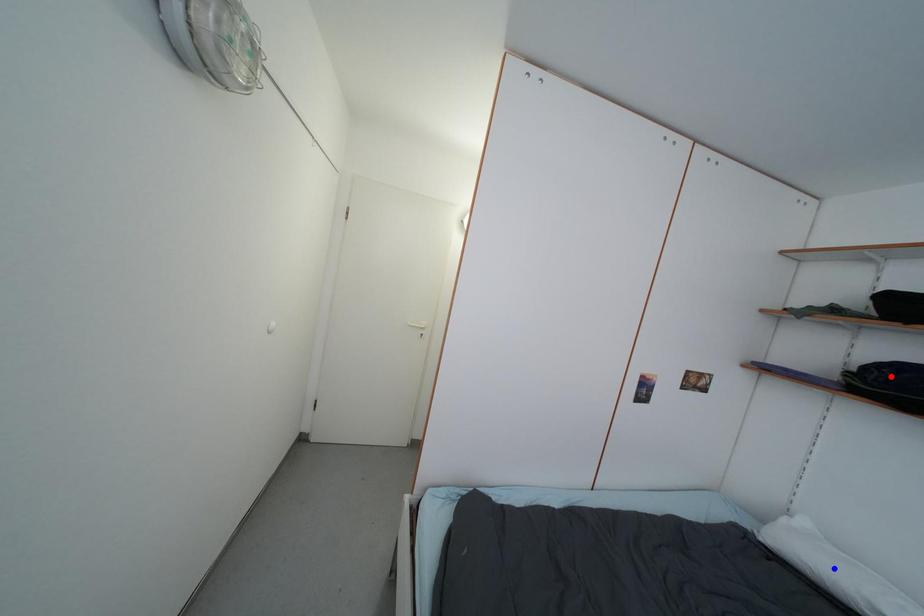
Question: Two points are marked on the image. Which point is closer to the camera?

Choices:
 (A) Blue point is closer.
 (B) Red point is closer.

Answer: (A)